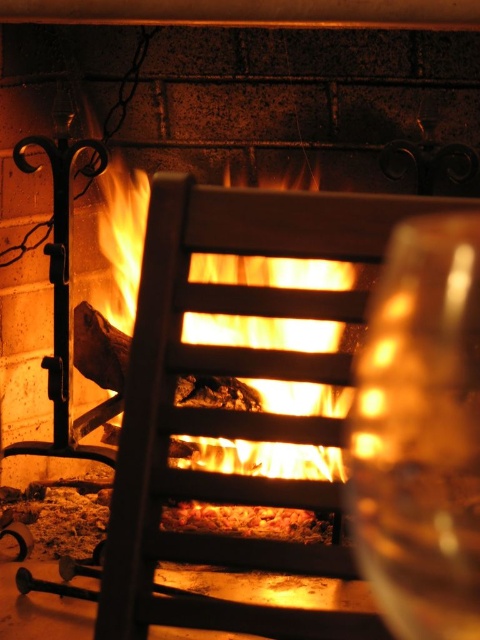
Question: Which point is closer to the camera?

Choices:
 (A) (423, 426)
 (B) (196, 467)

Answer: (A)

Question: Can you confirm if transparent glass at right is positioned above orange glowing wood at center?

Choices:
 (A) yes
 (B) no

Answer: (B)

Question: Which point appears farthest from the camera in this image?

Choices:
 (A) (453, 545)
 (B) (283, 412)

Answer: (B)

Question: Which object is farther from the camera taking this photo?

Choices:
 (A) orange glowing wood at center
 (B) transparent glass at right

Answer: (A)

Question: Is transparent glass at right smaller than orange glowing wood at center?

Choices:
 (A) yes
 (B) no

Answer: (A)

Question: Does transparent glass at right come in front of orange glowing wood at center?

Choices:
 (A) no
 (B) yes

Answer: (B)